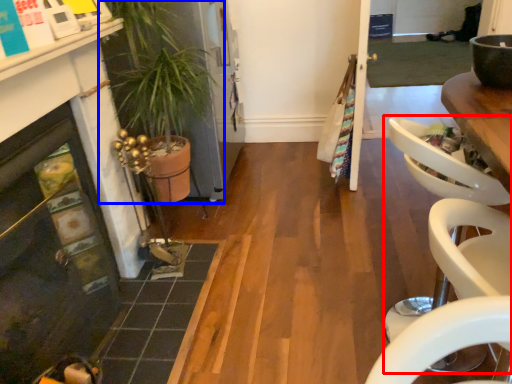
Question: Which object appears farthest to the camera in this image, armchair (highlighted by a red box) or houseplant (highlighted by a blue box)?

Choices:
 (A) armchair
 (B) houseplant

Answer: (B)